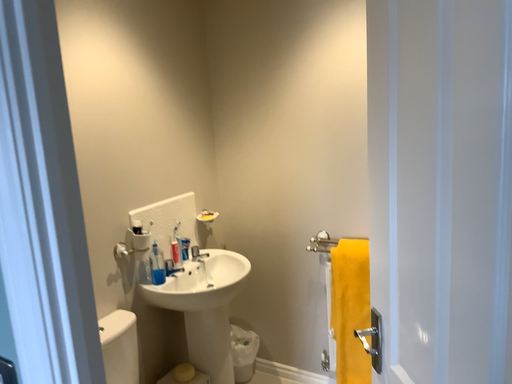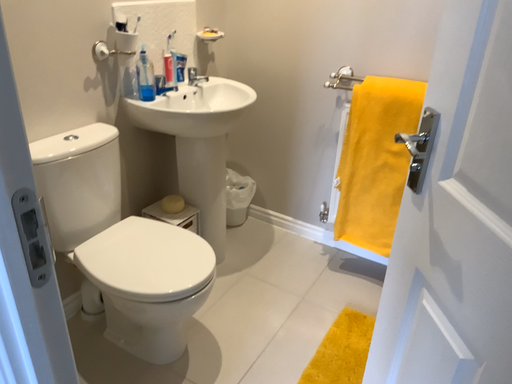
Question: Which way did the camera rotate in the video?

Choices:
 (A) rotated upward
 (B) rotated downward

Answer: (B)